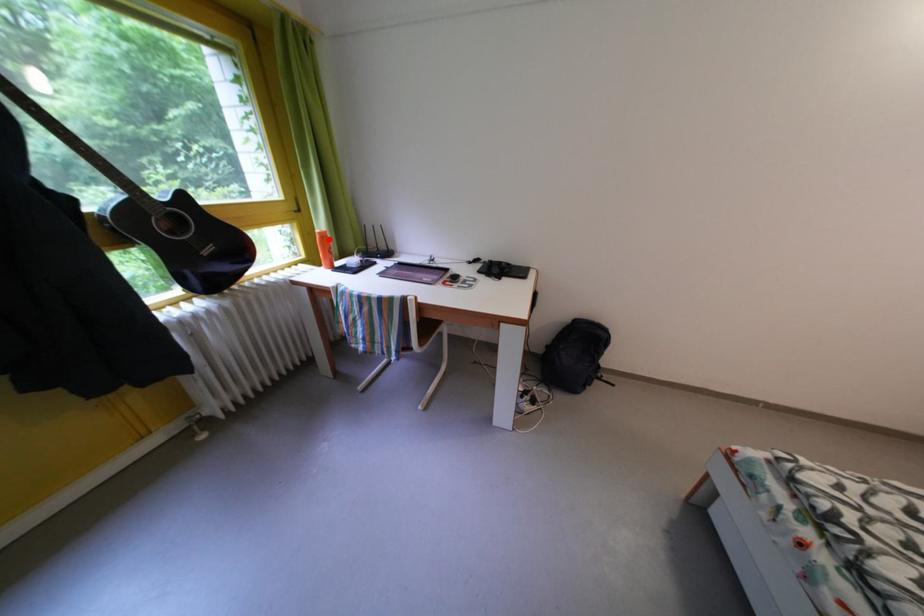
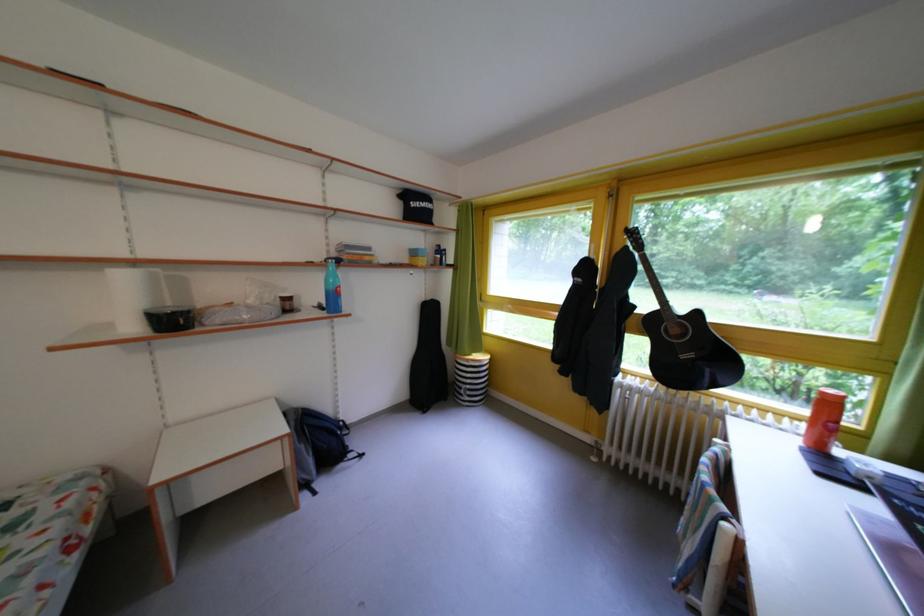
Question: I am providing you with two images of the same scene from different viewpoints. Given a red point in image1, look at the same physical point in image2. Is it:

Choices:
 (A) Closer to the viewpoint
 (B) Farther from the viewpoint

Answer: (B)